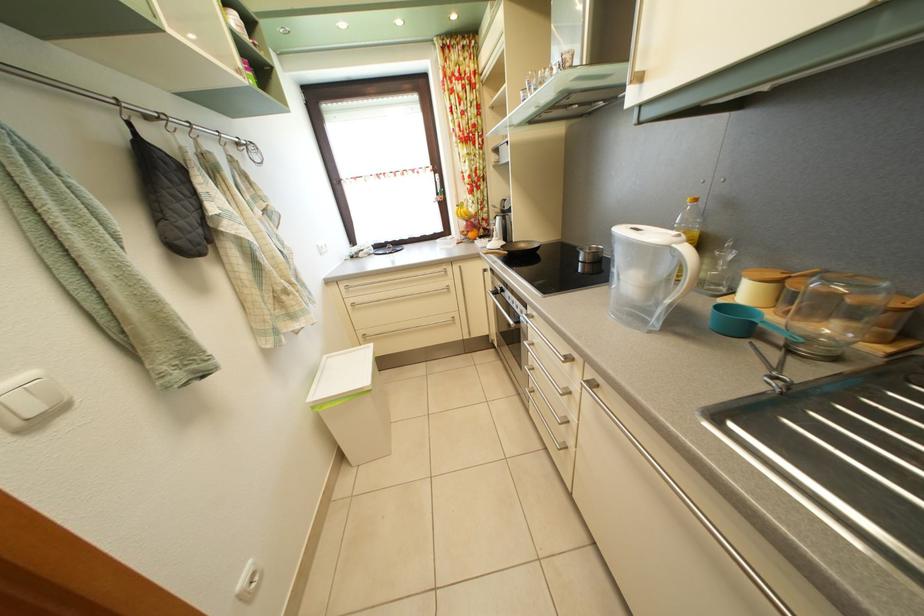
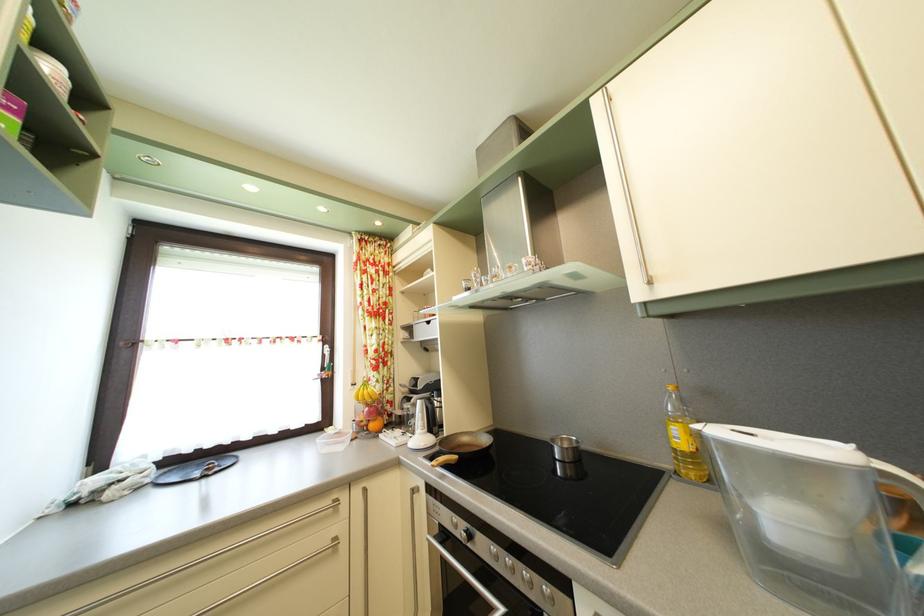
Based on the continuous images, in which direction is the camera rotating?

The camera rotated toward right-up.